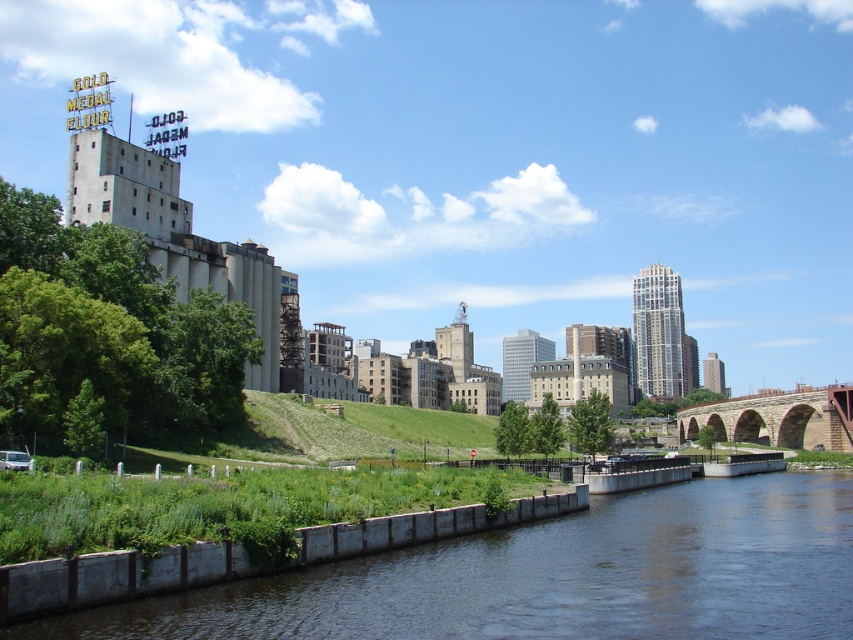
This screenshot has width=853, height=640. Describe the element at coordinates (553, 577) in the screenshot. I see `dark gray concrete wall at lower center` at that location.

Between dark gray concrete wall at lower center and brown stone bridge at lower right, which one appears on the left side from the viewer's perspective?

From the viewer's perspective, dark gray concrete wall at lower center appears more on the left side.

At what (x,y) coordinates should I click in order to perform the action: click on dark gray concrete wall at lower center. Please return your answer as a coordinate pair (x, y). This screenshot has height=640, width=853. Looking at the image, I should click on (553, 577).